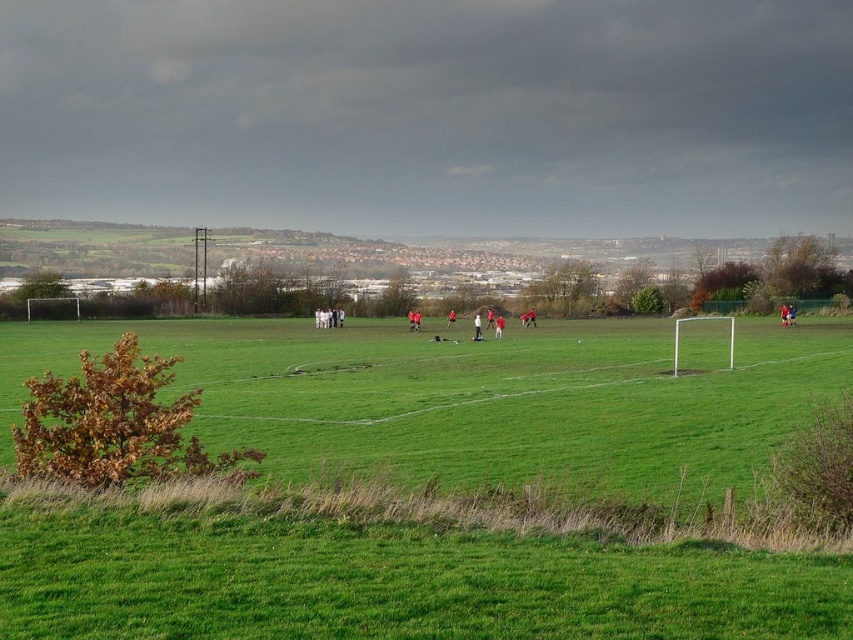
Is point (474, 326) less distant than point (527, 324)?

Yes, it is in front of point (527, 324).

Is point (477, 317) farther from camera compared to point (531, 321)?

No.

Locate an element on the screen. The width and height of the screenshot is (853, 640). matte red soccer ball at center is located at coordinates (477, 326).

Is matte red soccer ball at center positioned before red jersey soccer player at center?

Yes, it is in front of red jersey soccer player at center.

Between matte red soccer ball at center and red jersey soccer player at center, which one has less height?

red jersey soccer player at center is shorter.

The image size is (853, 640). What are the coordinates of `matte red soccer ball at center` in the screenshot? It's located at (477, 326).

Between point (534, 312) and point (448, 314), which one is positioned in front?

Point (534, 312)

Is point (524, 324) in front of point (450, 323)?

That is True.

Image resolution: width=853 pixels, height=640 pixels. I want to click on red jersey at center, so click(531, 317).